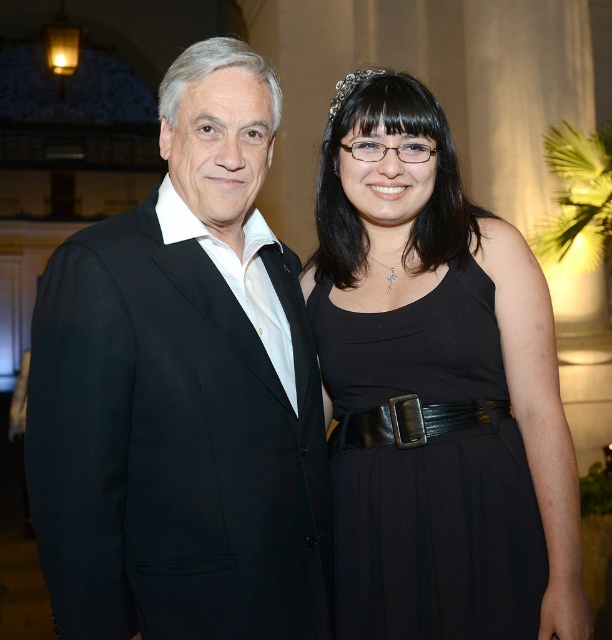
You are a photographer at a formal event and need to position two subjects for a portrait. You have a camera with a focal length that requires subjects to be at least 6 feet apart for optimal focus. The black matte suit at left and the black leather dress at center are currently positioned in the scene. Can they stay in their current positions, or do they need to move farther apart?

The black matte suit at left is 5.64 feet from the black leather dress at center. Since the required distance for optimal focus is 6 feet, they need to move farther apart to meet the camera requirement.

You are a photographer at a formal event. You need to capture a photo of the black matte suit at left and the silver metallic tiara at upper center. From the perspective of the camera, which object is located lower?

The black matte suit at left is positioned under the silver metallic tiara at upper center, so the black matte suit at left is lower.